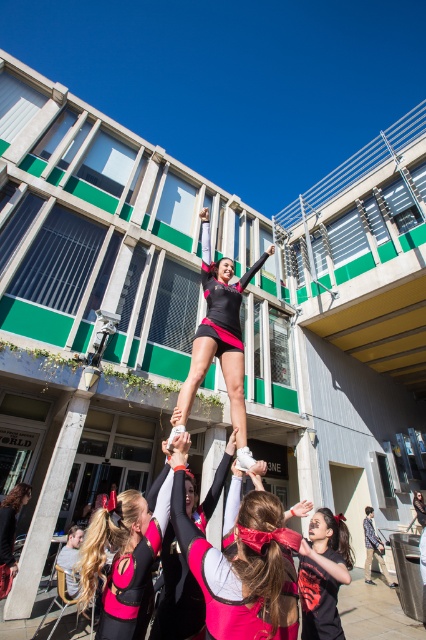
Question: Which object is the closest to the matte pink cheerleader at center?

Choices:
 (A) matte pink uniform at center
 (B) matte black shirt at center

Answer: (A)

Question: Which of the following is the farthest from the observer?

Choices:
 (A) (244, 278)
 (B) (158, 522)
 (C) (221, 596)

Answer: (A)

Question: Can you confirm if matte pink uniform at center is positioned below matte black leotard at center?

Choices:
 (A) yes
 (B) no

Answer: (A)

Question: Among these objects, which one is nearest to the camera?

Choices:
 (A) matte pink cheerleader at center
 (B) matte pink uniform at center
 (C) matte black shirt at center
 (D) matte black leotard at center

Answer: (A)

Question: Does matte pink uniform at center appear under matte black shirt at center?

Choices:
 (A) no
 (B) yes

Answer: (A)

Question: Considering the relative positions of matte pink uniform at center and matte pink cheerleader at center in the image provided, where is matte pink uniform at center located with respect to matte pink cheerleader at center?

Choices:
 (A) below
 (B) above

Answer: (A)